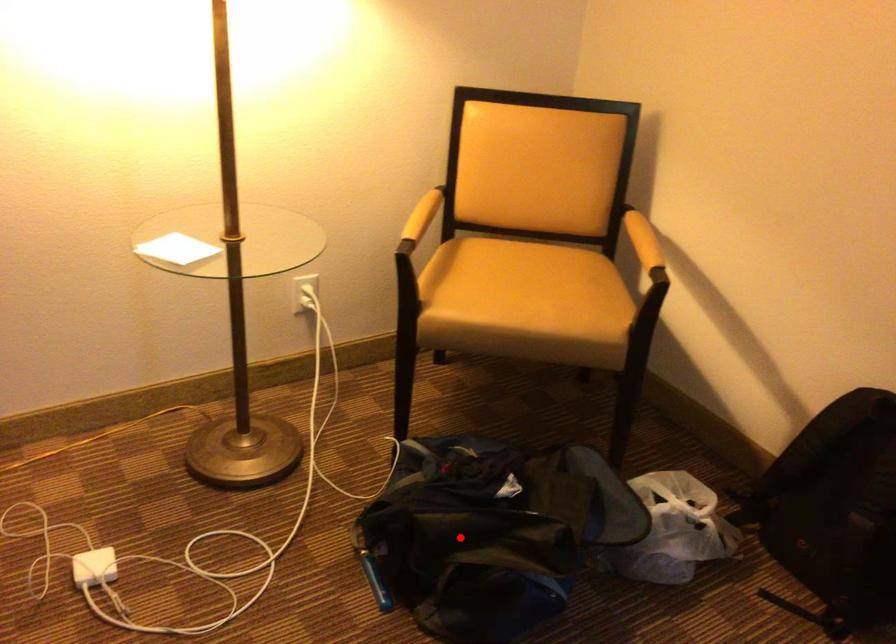
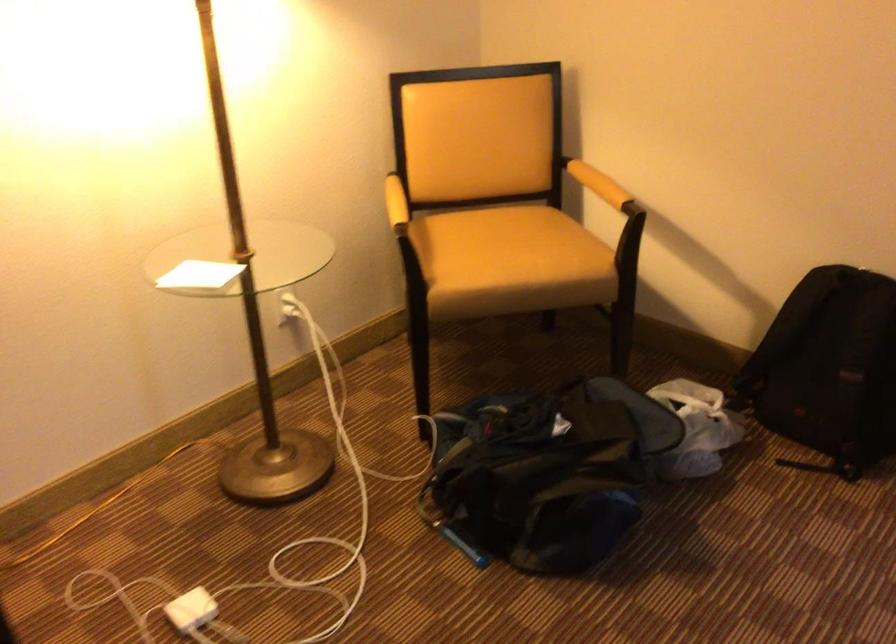
Locate, in the second image, the point that corresponds to the highlighted location in the first image.

(537, 480)